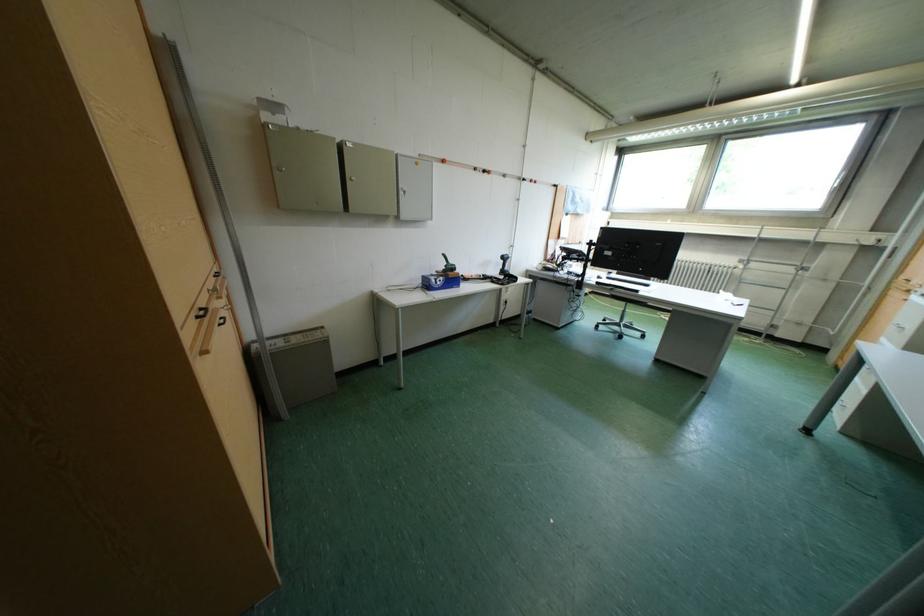
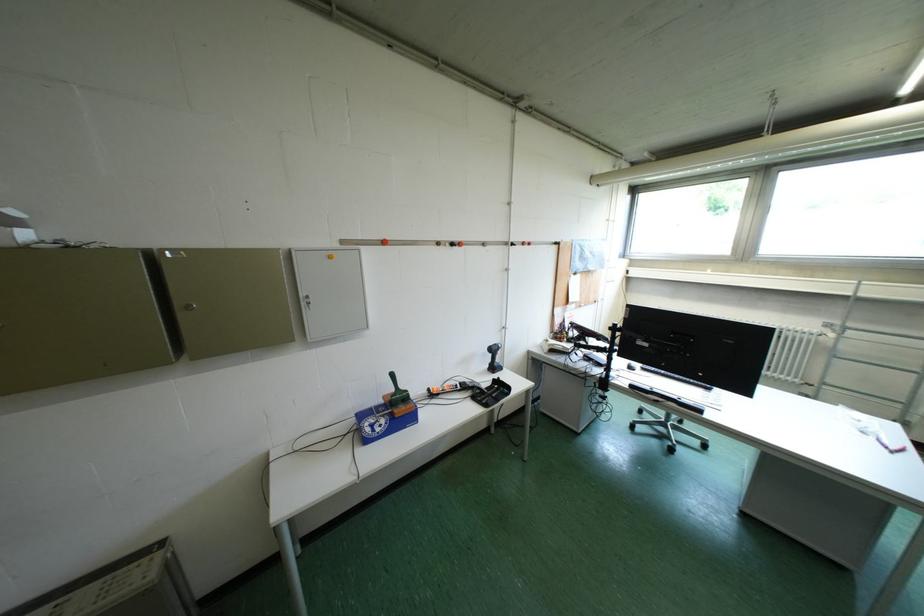
In a continuous first-person perspective shot, in which direction is the camera moving?

The movement direction of the cameraman is right, forward.